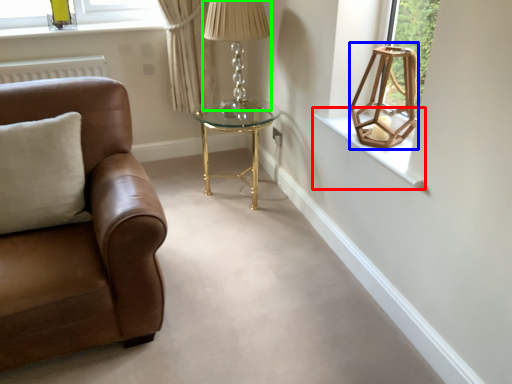
Question: Which is nearer to the window sill (highlighted by a red box)? lamp (highlighted by a blue box) or table lamp (highlighted by a green box).

Choices:
 (A) lamp
 (B) table lamp

Answer: (A)